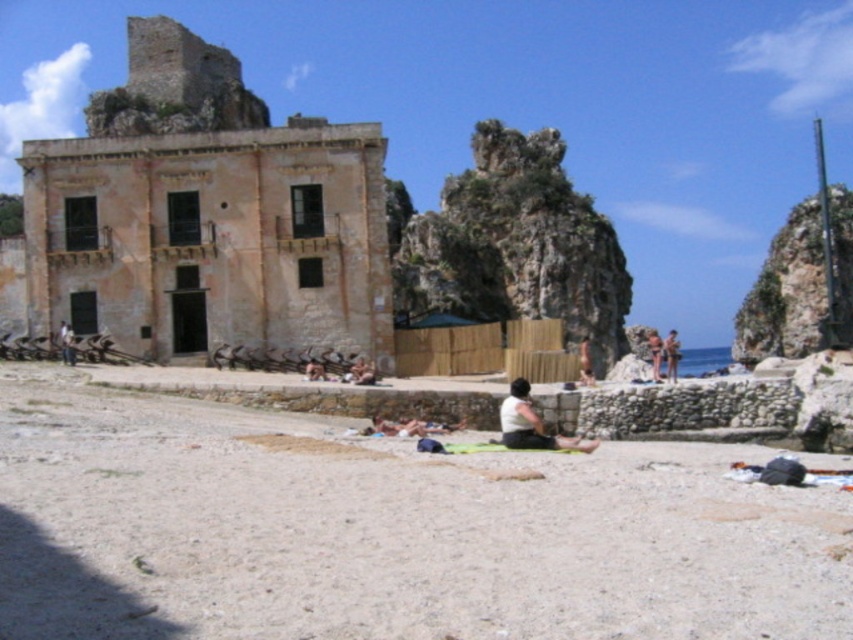
Question: Does dark skin textured person at center come behind smooth tan skin at lower center?

Choices:
 (A) no
 (B) yes

Answer: (B)

Question: Which object appears farthest from the camera in this image?

Choices:
 (A) matte skin person at center
 (B) white fabric at lower center
 (C) light beige sand at lower center

Answer: (A)

Question: Is white fabric at lower center to the left of smooth tan skin at lower center from the viewer's perspective?

Choices:
 (A) yes
 (B) no

Answer: (B)

Question: Among these points, which one is nearest to the camera?

Choices:
 (A) (671, 337)
 (B) (589, 339)

Answer: (B)

Question: Does matte black person at lower left have a greater width compared to dark skin textured person at center?

Choices:
 (A) no
 (B) yes

Answer: (A)

Question: Among these objects, which one is farthest from the camera?

Choices:
 (A) matte black person at lower left
 (B) dark skin textured person at center

Answer: (B)